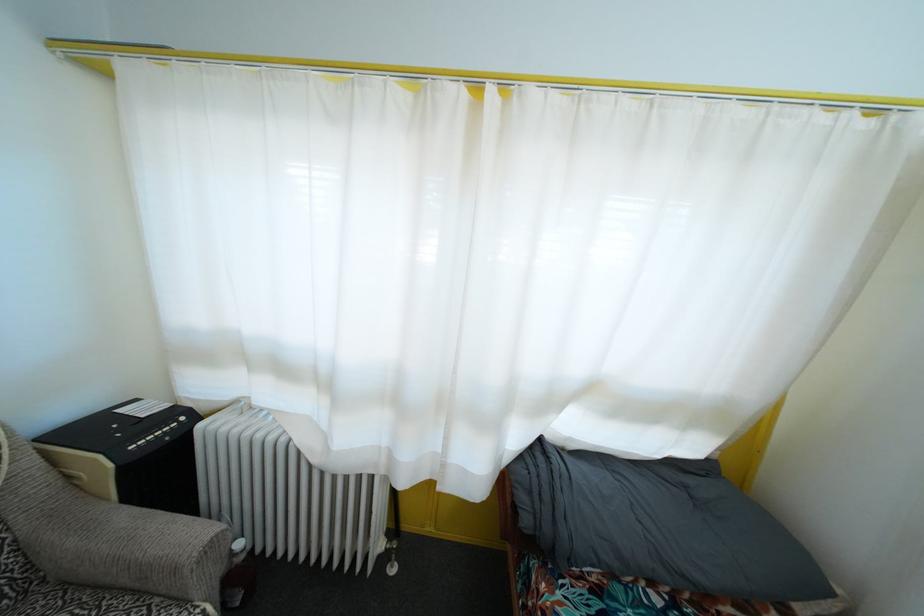
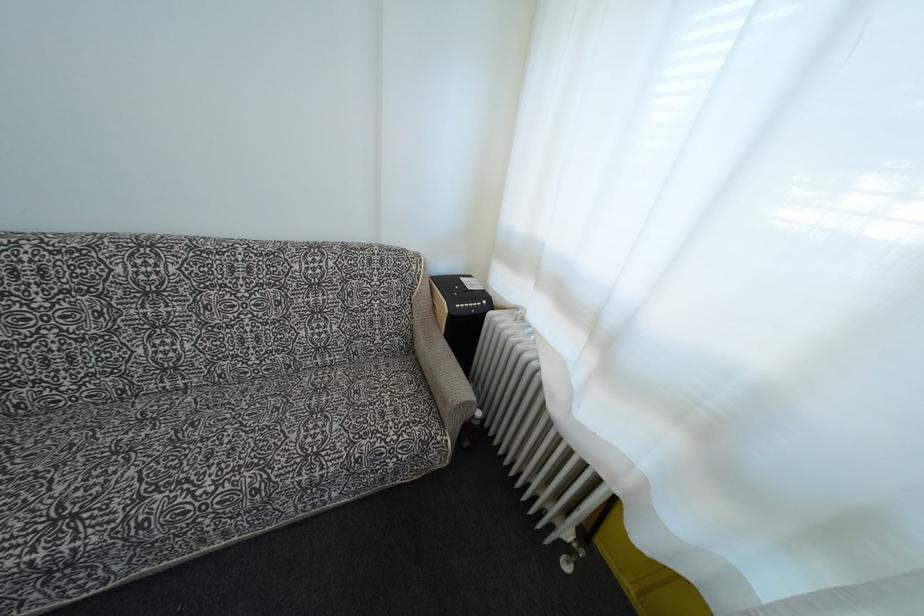
In the second image, find the point that corresponds to [222,541] in the first image.

(472, 408)